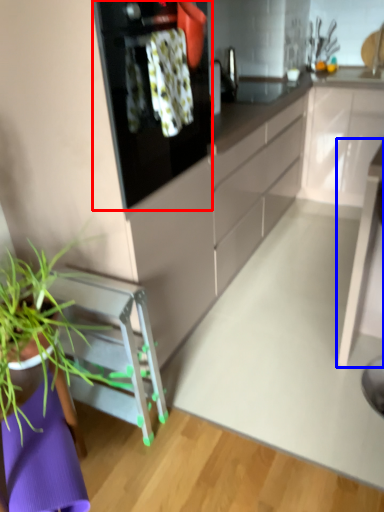
Question: Among these objects, which one is nearest to the camera, kitchen appliance (highlighted by a red box) or table (highlighted by a blue box)?

Choices:
 (A) kitchen appliance
 (B) table

Answer: (A)